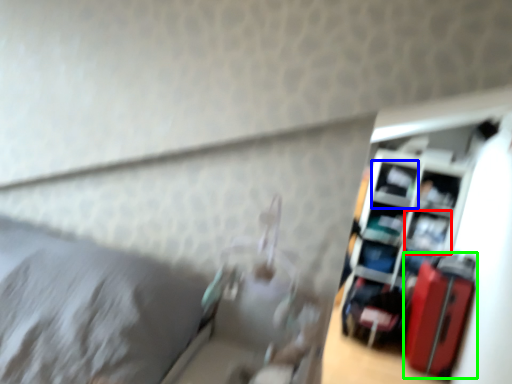
Question: Considering the real-world distances, which object is farthest from shelf (highlighted by a red box)? shelf (highlighted by a blue box) or luggage (highlighted by a green box)?

Choices:
 (A) shelf
 (B) luggage

Answer: (B)